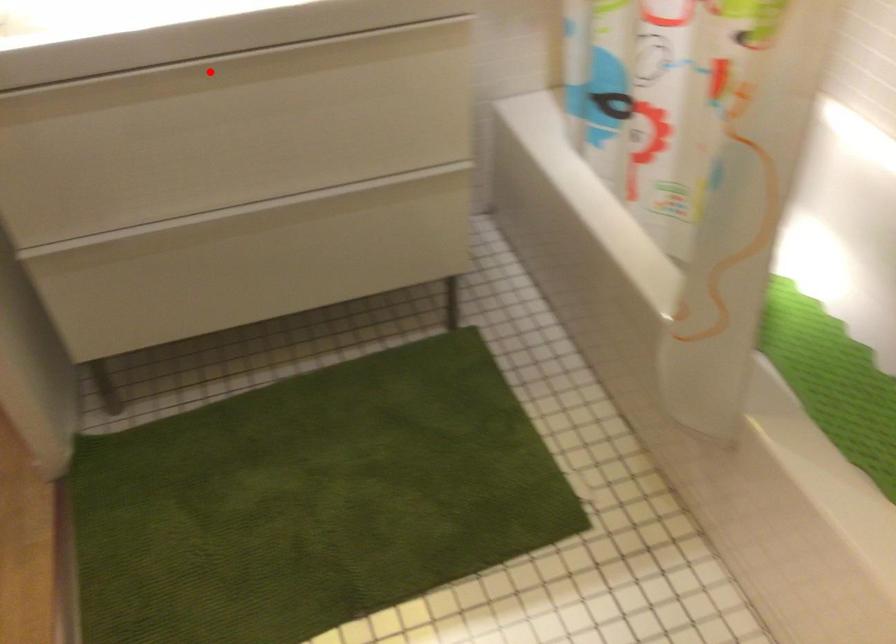
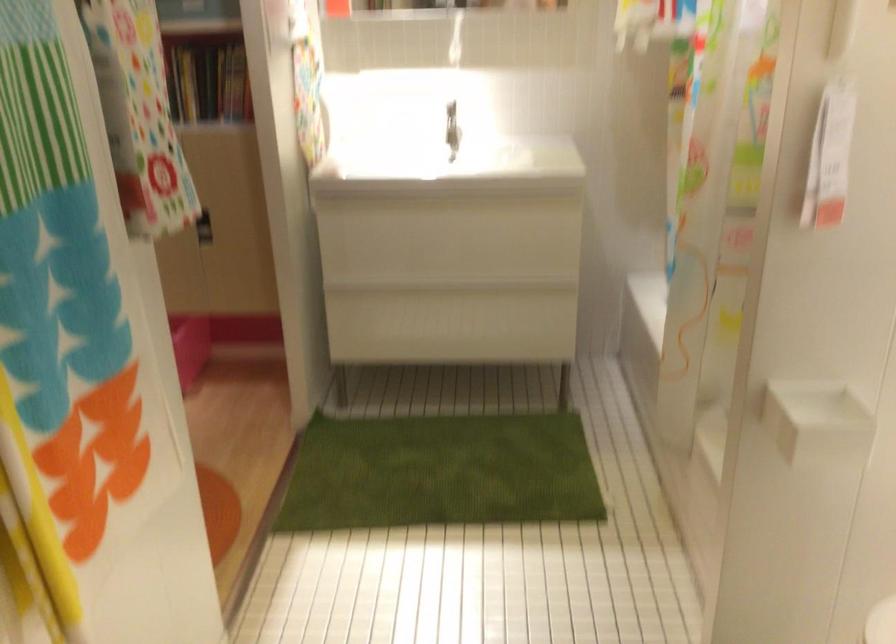
In the second image, find the point that corresponds to the highlighted location in the first image.

(440, 201)